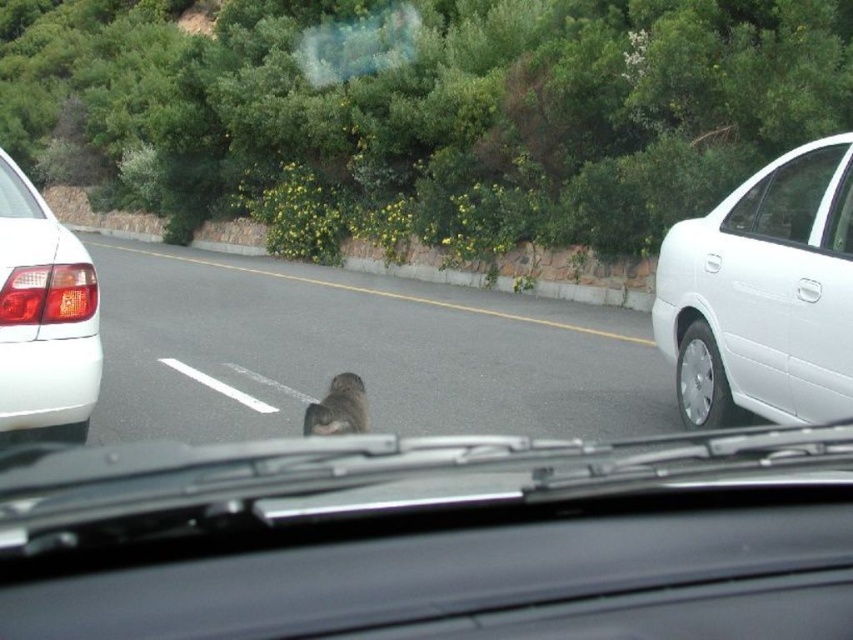
Question: Is black plastic dashboard at center above black plastic license plate at left?

Choices:
 (A) no
 (B) yes

Answer: (A)

Question: Among these objects, which one is nearest to the camera?

Choices:
 (A) furry gray animal at center
 (B) white metallic car at right
 (C) black plastic license plate at center
 (D) white glossy sedan at left

Answer: (D)

Question: Where is black plastic dashboard at center located in relation to transparent glass windshield at upper left in the image?

Choices:
 (A) right
 (B) left

Answer: (A)

Question: Estimate the real-world distances between objects in this image. Which object is farther from the black plastic license plate at center?

Choices:
 (A) furry gray animal at center
 (B) white metallic car at right
 (C) black plastic dashboard at center
 (D) black plastic license plate at left

Answer: (B)

Question: Is white glossy sedan at left wider than black plastic license plate at center?

Choices:
 (A) yes
 (B) no

Answer: (A)

Question: Which of the following is the farthest from the observer?

Choices:
 (A) white glossy sedan at left
 (B) gray asphalt road at center
 (C) black plastic dashboard at center
 (D) white metallic car at right

Answer: (B)